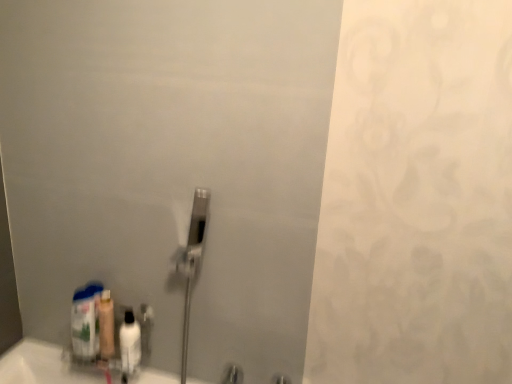
Question: Is point (130, 312) positioned closer to the camera than point (77, 352)?

Choices:
 (A) closer
 (B) farther

Answer: (B)

Question: Do you think white glossy bottle at lower left, the 2th mouthwash in the left-to-right sequence, is within translucent plastic bottle at lower left, or outside of it?

Choices:
 (A) outside
 (B) inside

Answer: (A)

Question: Estimate the real-world distances between objects in this image. Which object is farther from the white glossy bottle at lower left, which is the first mouthwash from right to left?

Choices:
 (A) translucent plastic mouthwash at lower left, which is the 1th mouthwash in left-to-right order
 (B) translucent plastic bottle at lower left

Answer: (B)

Question: Which of these objects is positioned closest to the translucent plastic bottle at lower left?

Choices:
 (A) translucent plastic mouthwash at lower left, the second mouthwash positioned from the right
 (B) white glossy bottle at lower left, which is the first mouthwash from right to left

Answer: (A)